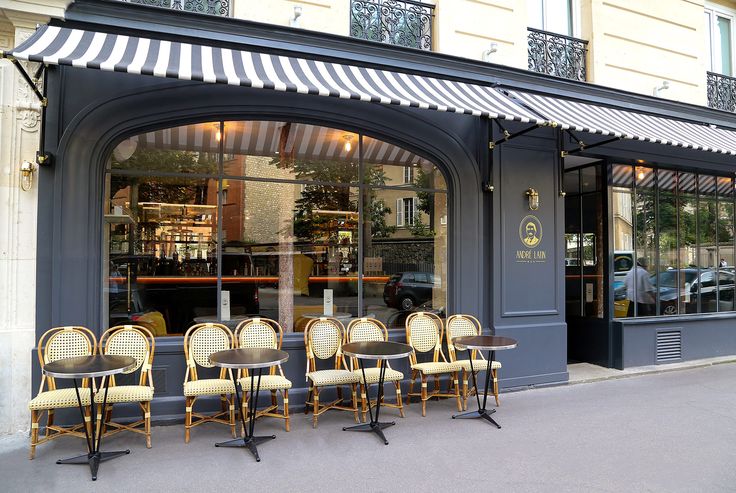
Find the location of a particular element. seat cushion is located at coordinates (130, 387), (63, 395), (205, 387), (266, 383), (335, 376), (375, 373), (442, 371), (481, 367).